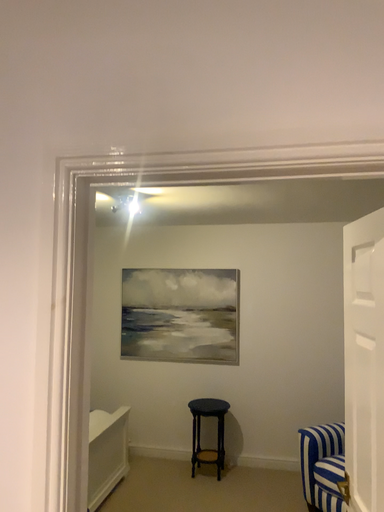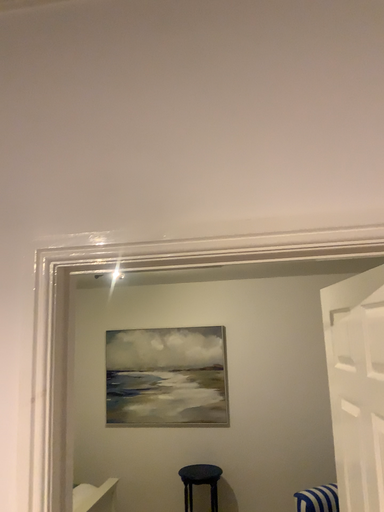
Question: How did the camera likely rotate when shooting the video?

Choices:
 (A) rotated downward
 (B) rotated upward

Answer: (B)